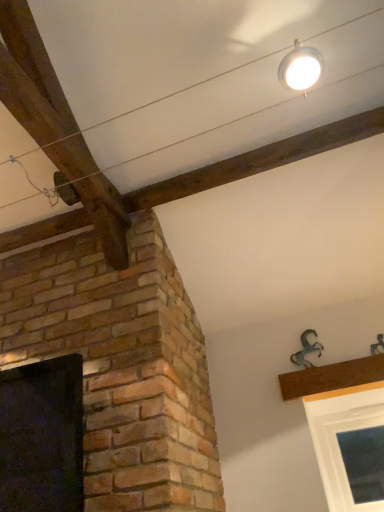
Find the location of a particular element. Image resolution: width=384 pixels, height=512 pixels. white glossy light fixture at upper center is located at coordinates click(x=300, y=67).

Measure the distance between point (307, 62) and camera.

Point (307, 62) is 1.40 meters away from camera.

Describe the element at coordinates (300, 67) in the screenshot. This screenshot has width=384, height=512. I see `white glossy light fixture at upper center` at that location.

The image size is (384, 512). What do you see at coordinates (42, 436) in the screenshot?
I see `black glass window at left` at bounding box center [42, 436].

Where is `black glass window at left`? This screenshot has height=512, width=384. black glass window at left is located at coordinates (42, 436).

Image resolution: width=384 pixels, height=512 pixels. In order to click on white glossy light fixture at upper center in this screenshot , I will do `click(300, 67)`.

Would you say black glass window at left is to the left or to the right of white glossy light fixture at upper center in the picture?

From the image, it's evident that black glass window at left is to the left of white glossy light fixture at upper center.

Which is in front, black glass window at left or white glossy light fixture at upper center?

white glossy light fixture at upper center.

Is point (43, 402) positioned behind point (282, 67)?

Yes, it is.

From the image's perspective, would you say black glass window at left is positioned over white glossy light fixture at upper center?

No, from the image's perspective, black glass window at left is not on top of white glossy light fixture at upper center.

From a real-world perspective, is black glass window at left beneath white glossy light fixture at upper center?

Yes.

Which object is wider, black glass window at left or white glossy light fixture at upper center?

black glass window at left is wider.

Is black glass window at left taller or shorter than white glossy light fixture at upper center?

black glass window at left is taller than white glossy light fixture at upper center.

Can you confirm if black glass window at left is bigger than white glossy light fixture at upper center?

Yes.

Is black glass window at left outside of white glossy light fixture at upper center?

Absolutely, black glass window at left is external to white glossy light fixture at upper center.

Are black glass window at left and white glossy light fixture at upper center located far from each other?

Indeed, black glass window at left is not near white glossy light fixture at upper center.

Is black glass window at left oriented away from white glossy light fixture at upper center?

black glass window at left is not turned away from white glossy light fixture at upper center.

Where is `light fixture in front of the black glass window at left`? The height and width of the screenshot is (512, 384). light fixture in front of the black glass window at left is located at coordinates (300, 67).

Is white glossy light fixture at upper center to the left or to the right of black glass window at left in the image?

In the image, white glossy light fixture at upper center appears on the right side of black glass window at left.

Considering their positions, is white glossy light fixture at upper center located in front of or behind black glass window at left?

Visually, white glossy light fixture at upper center is located in front of black glass window at left.

Does point (310, 68) come in front of point (50, 443)?

Yes, it is.

From the image's perspective, between white glossy light fixture at upper center and black glass window at left, which one is located above?

white glossy light fixture at upper center.

From a real-world perspective, is white glossy light fixture at upper center positioned under black glass window at left based on gravity?

No, from a real-world perspective, white glossy light fixture at upper center is not beneath black glass window at left.

Considering the relative sizes of white glossy light fixture at upper center and black glass window at left in the image provided, is white glossy light fixture at upper center thinner than black glass window at left?

Indeed, white glossy light fixture at upper center has a lesser width compared to black glass window at left.

Considering the relative sizes of white glossy light fixture at upper center and black glass window at left in the image provided, is white glossy light fixture at upper center shorter than black glass window at left?

Yes, white glossy light fixture at upper center is shorter than black glass window at left.

Between white glossy light fixture at upper center and black glass window at left, which one has smaller size?

white glossy light fixture at upper center.

Choose the correct answer: Is white glossy light fixture at upper center inside black glass window at left or outside it?

The correct answer is: outside.

Are white glossy light fixture at upper center and black glass window at left far apart?

white glossy light fixture at upper center is far away from black glass window at left.

Is black glass window at left at the back of white glossy light fixture at upper center?

No.

How many degrees apart are the facing directions of white glossy light fixture at upper center and black glass window at left?

They differ by 89.4 degrees in their facing directions.

This screenshot has height=512, width=384. Find the location of `light fixture in front of the black glass window at left`. light fixture in front of the black glass window at left is located at coordinates (300, 67).

Locate an element on the screen. This screenshot has width=384, height=512. window below the white glossy light fixture at upper center (from a real-world perspective) is located at coordinates (42, 436).

I want to click on window below the white glossy light fixture at upper center (from the image's perspective), so click(42, 436).